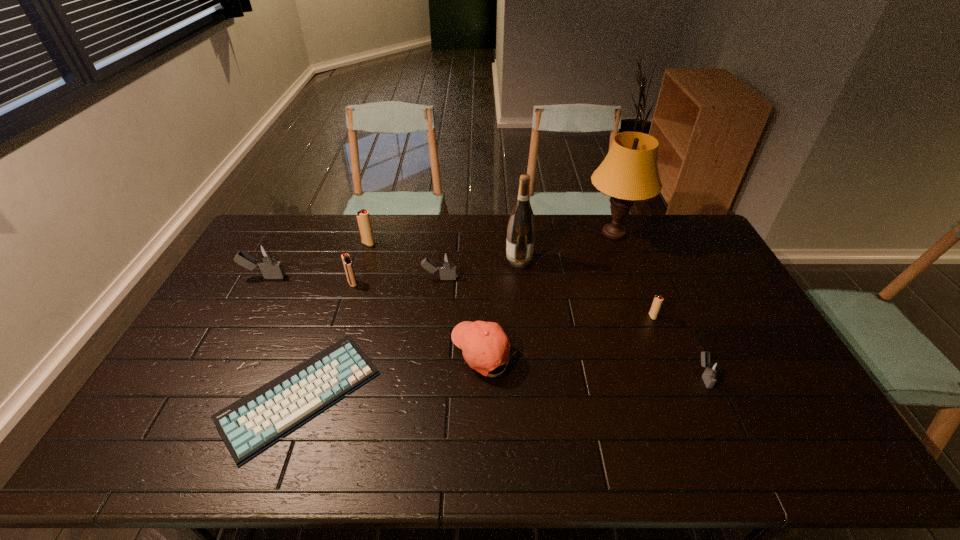
In order to click on free space between the second biggest gray igniter and the second igniter from right to left in this screenshot , I will do `click(546, 298)`.

Find the location of a particular element. Image resolution: width=960 pixels, height=540 pixels. vacant space that is in between the second smallest red igniter and the leftmost gray igniter is located at coordinates (308, 280).

In order to click on vacant area that lies between the second farthest red igniter and the smallest gray igniter in this screenshot , I will do `click(528, 330)`.

I want to click on free space between the nearest gray igniter and the second nearest red igniter, so click(528, 330).

Identify the location of free space between the biggest gray igniter and the biggest red igniter. (317, 260).

Find the location of a particular element. The image size is (960, 540). vacant point located between the brown wine bottle and the leftmost object is located at coordinates (392, 269).

The height and width of the screenshot is (540, 960). Find the location of `vacant area between the second smallest gray igniter and the rightmost igniter`. vacant area between the second smallest gray igniter and the rightmost igniter is located at coordinates (571, 327).

This screenshot has height=540, width=960. I want to click on blank region between the second biggest red igniter and the lampshade, so click(483, 259).

Choose which object is the seventh nearest neighbor to the baseball cap. Please provide its 2D coordinates. Your answer should be formatted as a tuple, i.e. [(x, y)], where the tuple contains the x and y coordinates of a point satisfying the conditions above.

[(712, 368)]

Where is `object that is the seventh closest to the shortest object`? The height and width of the screenshot is (540, 960). object that is the seventh closest to the shortest object is located at coordinates (629, 172).